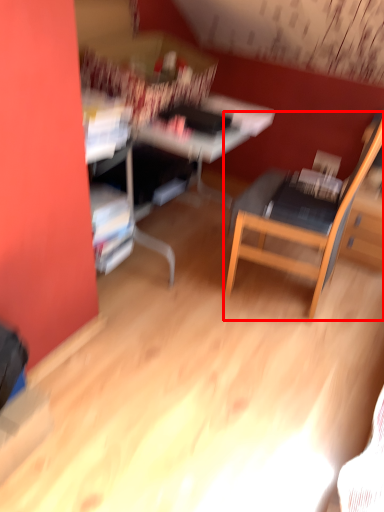
Question: Where is chair (annotated by the red box) located in relation to computer desk in the image?

Choices:
 (A) right
 (B) left

Answer: (A)